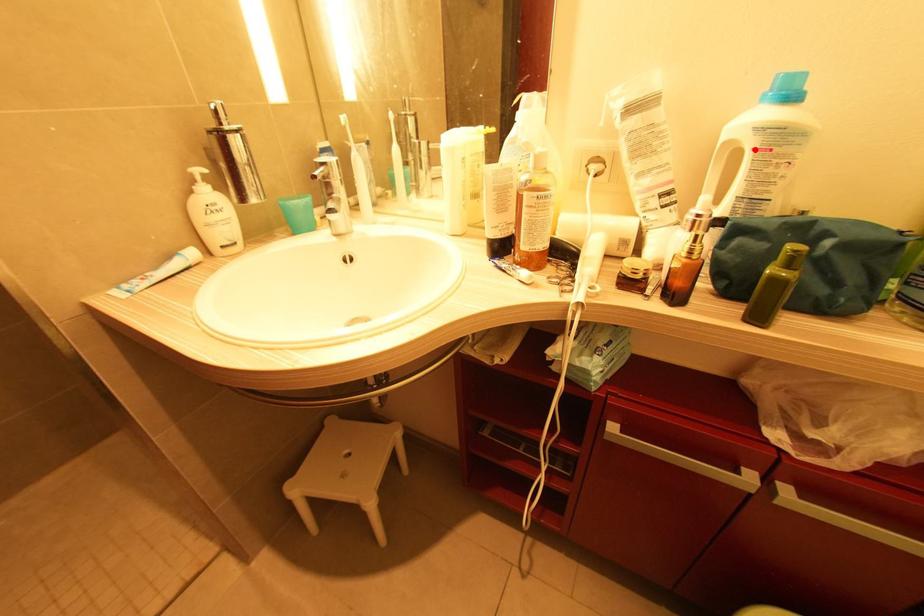
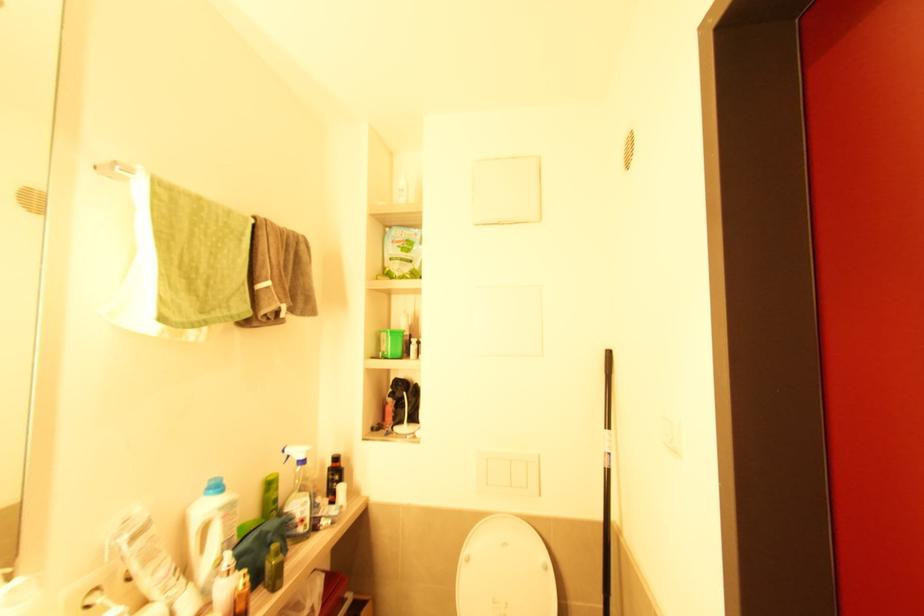
Where in the second image is the point corresponding to the highlighted location from the first image?

(224, 519)